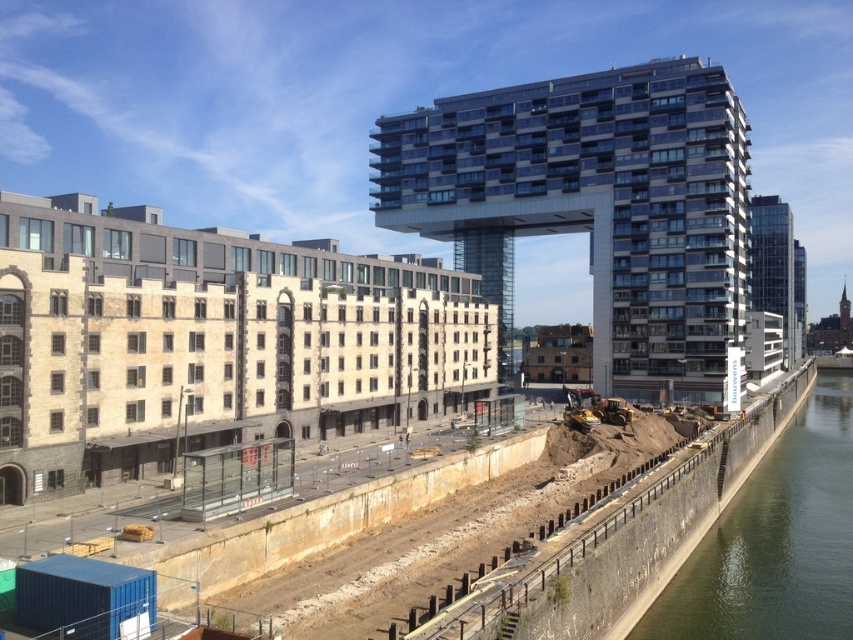
Question: Can you confirm if green concrete wall at lower right is positioned below glassy modern building at right?

Choices:
 (A) no
 (B) yes

Answer: (B)

Question: Does glassy steel building at center have a lesser width compared to brown dirt at lower center?

Choices:
 (A) yes
 (B) no

Answer: (A)

Question: Which point is closer to the camera?

Choices:
 (A) glassy modern building at right
 (B) brown dirt at lower center

Answer: (B)

Question: Estimate the real-world distances between objects in this image. Which object is closer to the glassy steel building at center?

Choices:
 (A) glassy modern building at right
 (B) brown dirt at lower center

Answer: (B)

Question: Estimate the real-world distances between objects in this image. Which object is farther from the glassy modern building at right?

Choices:
 (A) green concrete wall at lower right
 (B) brown dirt at lower center
 (C) glassy steel building at center
 (D) beige stone building at center

Answer: (D)

Question: Observing the image, what is the correct spatial positioning of beige stone building at center in reference to green concrete wall at lower right?

Choices:
 (A) left
 (B) right

Answer: (A)